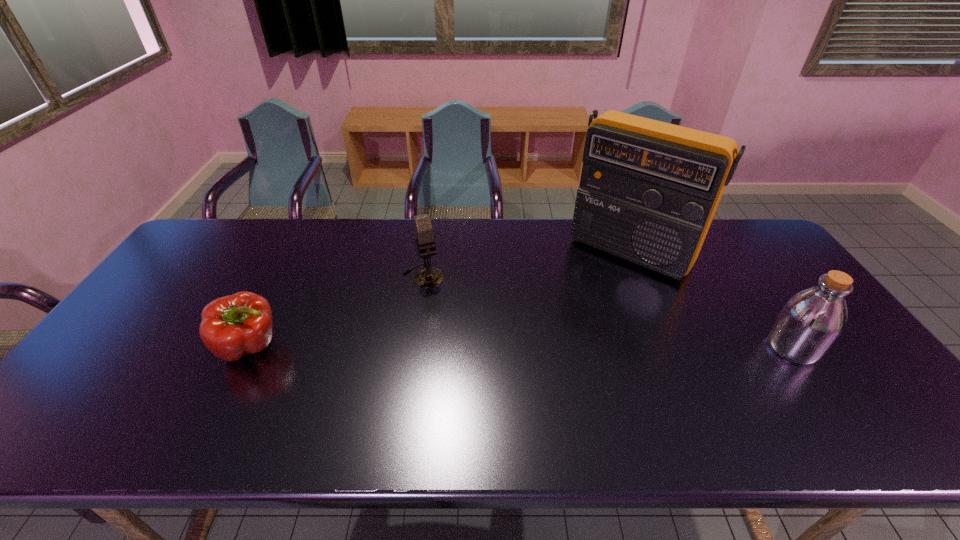
Find the location of a particular element. the shortest object is located at coordinates (233, 326).

Locate an element on the screen. This screenshot has height=540, width=960. pepper is located at coordinates (233, 326).

This screenshot has width=960, height=540. I want to click on the rightmost object, so click(811, 321).

This screenshot has height=540, width=960. In order to click on the third object from right to left in this screenshot , I will do `click(428, 277)`.

Locate an element on the screen. The height and width of the screenshot is (540, 960). the tallest object is located at coordinates (648, 192).

In order to click on radio receiver in this screenshot , I will do tap(648, 192).

Identify the location of free space located on the back of the pepper. This screenshot has height=540, width=960. (294, 261).

The image size is (960, 540). Find the location of `vacant space located on the front of the bottle`. vacant space located on the front of the bottle is located at coordinates (826, 395).

Where is `vacant space located 0.290m on the front-facing side of the second object from left to right`? The image size is (960, 540). vacant space located 0.290m on the front-facing side of the second object from left to right is located at coordinates pyautogui.click(x=462, y=359).

This screenshot has width=960, height=540. Identify the location of vacant region located 0.130m on the front-facing side of the second object from left to right. (443, 316).